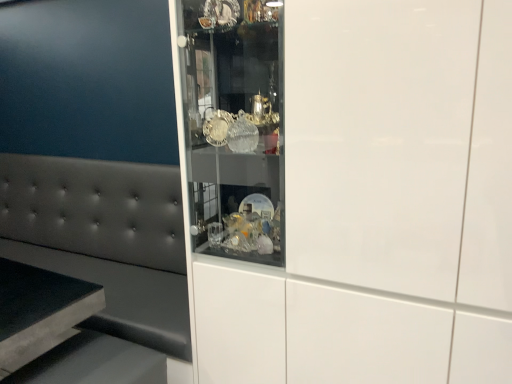
Describe the element at coordinates (104, 239) in the screenshot. Image resolution: width=512 pixels, height=384 pixels. I see `matte gray cushion at left` at that location.

Find the location of a particular element. The image size is (512, 384). matte gray cushion at left is located at coordinates pos(104,239).

What is the approximate width of matte gray cushion at left?

21.44 inches.

Locate an element on the screen. The height and width of the screenshot is (384, 512). white glossy cabinet at center is located at coordinates (347, 188).

What do you see at coordinates (347, 188) in the screenshot?
I see `white glossy cabinet at center` at bounding box center [347, 188].

Identify the location of matte gray cushion at left. (104, 239).

Between matte gray cushion at left and white glossy cabinet at center, which one appears on the right side from the viewer's perspective?

Positioned to the right is white glossy cabinet at center.

Is the depth of matte gray cushion at left greater than that of white glossy cabinet at center?

Yes, matte gray cushion at left is behind white glossy cabinet at center.

Which is farther, (27, 234) or (347, 214)?

The point (27, 234) is behind.

From the image's perspective, would you say matte gray cushion at left is positioned over white glossy cabinet at center?

Incorrect, from the image's perspective, matte gray cushion at left is lower than white glossy cabinet at center.

From a real-world perspective, which object rests below the other?

matte gray cushion at left is physically lower.

From the picture: Can you confirm if matte gray cushion at left is thinner than white glossy cabinet at center?

Yes, matte gray cushion at left is thinner than white glossy cabinet at center.

Considering the relative sizes of matte gray cushion at left and white glossy cabinet at center in the image provided, is matte gray cushion at left shorter than white glossy cabinet at center?

Yes, matte gray cushion at left is shorter than white glossy cabinet at center.

Does matte gray cushion at left have a larger size compared to white glossy cabinet at center?

Yes.

Can white glossy cabinet at center be found inside matte gray cushion at left?

That's incorrect, white glossy cabinet at center is not inside matte gray cushion at left.

Is matte gray cushion at left with white glossy cabinet at center?

No, matte gray cushion at left is not next to white glossy cabinet at center.

Looking at this image, is matte gray cushion at left aimed at white glossy cabinet at center?

No, matte gray cushion at left does not turn towards white glossy cabinet at center.

Can you tell me how much matte gray cushion at left and white glossy cabinet at center differ in facing direction?

0.667 degrees.

Measure the distance from matte gray cushion at left to white glossy cabinet at center.

They are 29.89 inches apart.

The height and width of the screenshot is (384, 512). What are the coordinates of `furniture on the left of white glossy cabinet at center` in the screenshot? It's located at (104, 239).

Considering the relative positions of white glossy cabinet at center and matte gray cushion at left in the image provided, is white glossy cabinet at center to the left or to the right of matte gray cushion at left?

Clearly, white glossy cabinet at center is on the right of matte gray cushion at left in the image.

Consider the image. Between white glossy cabinet at center and matte gray cushion at left, which one is positioned in front?

white glossy cabinet at center.

Is point (307, 66) positioned after point (144, 196)?

No.

From the image's perspective, between white glossy cabinet at center and matte gray cushion at left, which one is located above?

white glossy cabinet at center is shown above in the image.

From a real-world perspective, is white glossy cabinet at center physically above matte gray cushion at left?

Yes, from a real-world perspective, white glossy cabinet at center is on top of matte gray cushion at left.

Can you confirm if white glossy cabinet at center is thinner than matte gray cushion at left?

No, white glossy cabinet at center is not thinner than matte gray cushion at left.

In terms of height, does white glossy cabinet at center look taller or shorter compared to matte gray cushion at left?

In the image, white glossy cabinet at center appears to be taller than matte gray cushion at left.

Does white glossy cabinet at center have a smaller size compared to matte gray cushion at left?

Yes.

Is white glossy cabinet at center outside of matte gray cushion at left?

white glossy cabinet at center lies outside matte gray cushion at left's area.

Are white glossy cabinet at center and matte gray cushion at left located far from each other?

white glossy cabinet at center is actually quite close to matte gray cushion at left.

Could you tell me if white glossy cabinet at center is turned towards matte gray cushion at left?

No, white glossy cabinet at center is not turned towards matte gray cushion at left.

How many degrees apart are the facing directions of white glossy cabinet at center and matte gray cushion at left?

0.667 degrees separate the facing orientations of white glossy cabinet at center and matte gray cushion at left.

How far apart are white glossy cabinet at center and matte gray cushion at left?

white glossy cabinet at center is 75.93 centimeters away from matte gray cushion at left.

The image size is (512, 384). I want to click on cabinetry above the matte gray cushion at left (from a real-world perspective), so click(347, 188).

Find the location of a particular element. This screenshot has height=384, width=512. furniture located below the white glossy cabinet at center (from the image's perspective) is located at coordinates point(104,239).

This screenshot has height=384, width=512. In order to click on furniture to the left of white glossy cabinet at center in this screenshot , I will do `click(104, 239)`.